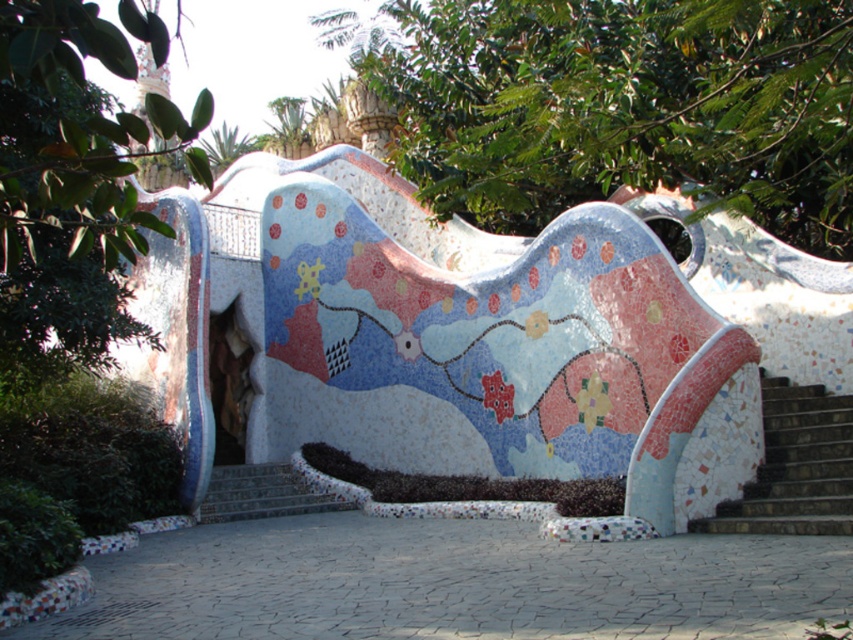
Does mosaic bench at center appear on the left side of dark brown stone stairs at right?

Indeed, mosaic bench at center is positioned on the left side of dark brown stone stairs at right.

How much distance is there between mosaic bench at center and dark brown stone stairs at right?

The distance of mosaic bench at center from dark brown stone stairs at right is 22.78 meters.

Describe the element at coordinates (480, 332) in the screenshot. I see `mosaic bench at center` at that location.

Where is `mosaic bench at center`? The image size is (853, 640). mosaic bench at center is located at coordinates (480, 332).

Is dark brown stone stairs at right smaller than multicolored mosaic stairs at center?

Actually, dark brown stone stairs at right might be larger than multicolored mosaic stairs at center.

In the scene shown: Who is more distant from viewer, (747,516) or (215,493)?

The point (215,493) is more distant.

Is point (737, 509) farther from viewer compared to point (264, 468)?

That is False.

This screenshot has width=853, height=640. In order to click on dark brown stone stairs at right in this screenshot , I will do point(795,467).

Consider the image. Which is more to the right, mosaic bench at center or multicolored mosaic stairs at center?

mosaic bench at center

Between mosaic bench at center and multicolored mosaic stairs at center, which one has more height?

With more height is mosaic bench at center.

Locate an element on the screen. The width and height of the screenshot is (853, 640). mosaic bench at center is located at coordinates (480, 332).